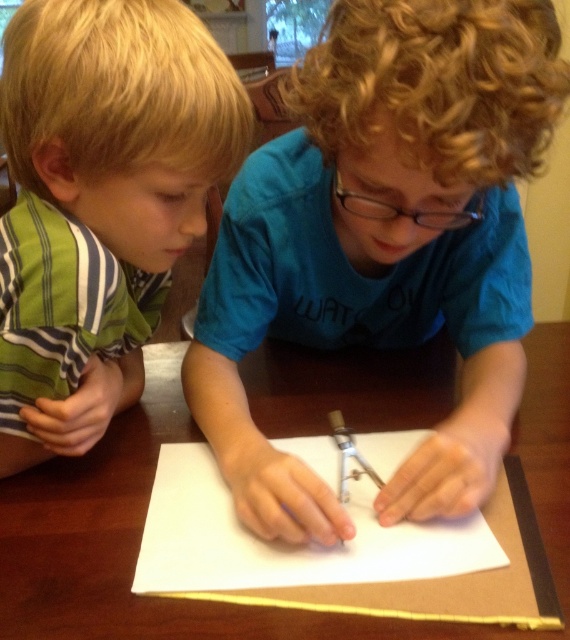
In the scene shown: You are a teacher observing two children at a table. You notice the green striped shirt at left and the metallic silver compass at center. Which object is positioned closer to the left side of the table?

The green striped shirt at left is positioned closer to the left side of the table because it is to the left of the metallic silver compass at center.

You need to place a rectangular box that is 15 cm long on the table. The box must be placed entirely on either the white paper at center or the metallic silver compass at center. Given their widths, which object can accommodate the box without overhanging?

The white paper at center has a greater width than the metallic silver compass at center. Since the box is 15 cm long, it can fit on the white paper at center if its width is at least 15 cm, but cannot fit on the metallic silver compass at center due to its narrower width.